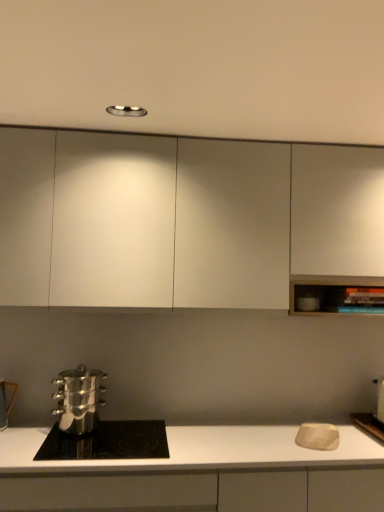
Question: Does matte white cutting board at right, positioned as the 1th appliance in right-to-left order, have a smaller size compared to metallic silver pot at lower left, which is the second appliance from right to left?

Choices:
 (A) no
 (B) yes

Answer: (A)

Question: Is matte white cutting board at right, the 2th appliance from the left, facing towards metallic silver pot at lower left, which is the second appliance from right to left?

Choices:
 (A) no
 (B) yes

Answer: (A)

Question: Is matte white cutting board at right, positioned as the 1th appliance in right-to-left order, placed right next to metallic silver pot at lower left, which is the second appliance from right to left?

Choices:
 (A) no
 (B) yes

Answer: (A)

Question: From the image's perspective, is matte white cutting board at right, the 2th appliance from the left, over metallic silver pot at lower left, positioned as the first appliance in left-to-right order?

Choices:
 (A) yes
 (B) no

Answer: (B)

Question: Can we say matte white cutting board at right, the 2th appliance from the left, lies outside metallic silver pot at lower left, positioned as the first appliance in left-to-right order?

Choices:
 (A) yes
 (B) no

Answer: (A)

Question: From a real-world perspective, is white matte countertop at lower center, acting as the first cabinetry starting from the bottom, positioned above or below polished stainless steel pot at lower left?

Choices:
 (A) below
 (B) above

Answer: (A)

Question: From the image's perspective, is white matte countertop at lower center, acting as the first cabinetry starting from the bottom, above or below polished stainless steel pot at lower left?

Choices:
 (A) below
 (B) above

Answer: (A)

Question: Looking at their shapes, would you say white matte countertop at lower center, acting as the first cabinetry starting from the bottom, is wider or thinner than polished stainless steel pot at lower left?

Choices:
 (A) wide
 (B) thin

Answer: (A)

Question: Does point (382, 482) appear closer or farther from the camera than point (139, 438)?

Choices:
 (A) closer
 (B) farther

Answer: (A)

Question: Based on their sizes in the image, would you say matte white cutting board at right, the 2th appliance from the left, is bigger or smaller than white matte countertop at lower center, acting as the first cabinetry starting from the bottom?

Choices:
 (A) small
 (B) big

Answer: (A)

Question: Would you say matte white cutting board at right, positioned as the 1th appliance in right-to-left order, is inside or outside white matte countertop at lower center, acting as the first cabinetry starting from the bottom?

Choices:
 (A) inside
 (B) outside

Answer: (B)

Question: From a real-world perspective, is matte white cutting board at right, the 2th appliance from the left, physically located above or below white matte countertop at lower center, acting as the first cabinetry starting from the bottom?

Choices:
 (A) above
 (B) below

Answer: (A)

Question: Looking at their shapes, would you say matte white cutting board at right, positioned as the 1th appliance in right-to-left order, is wider or thinner than white matte countertop at lower center, placed as the 2th cabinetry when sorted from top to bottom?

Choices:
 (A) wide
 (B) thin

Answer: (B)

Question: From the image's perspective, is polished stainless steel pot at lower left above or below polished stainless steel steamer at lower left?

Choices:
 (A) above
 (B) below

Answer: (B)

Question: Is point (82, 458) positioned closer to the camera than point (77, 390)?

Choices:
 (A) farther
 (B) closer

Answer: (B)